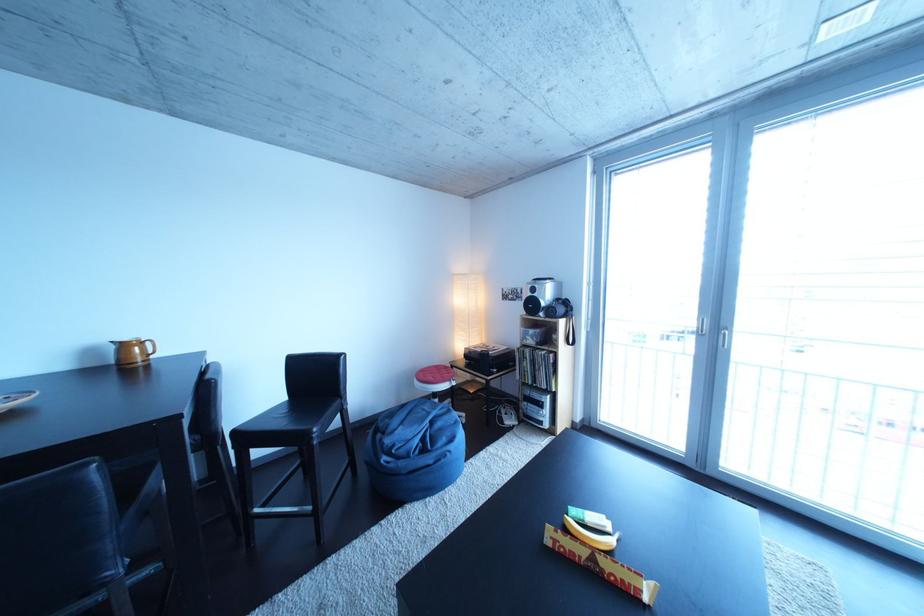
Where is `black chair sitting surface`? black chair sitting surface is located at coordinates (294, 416).